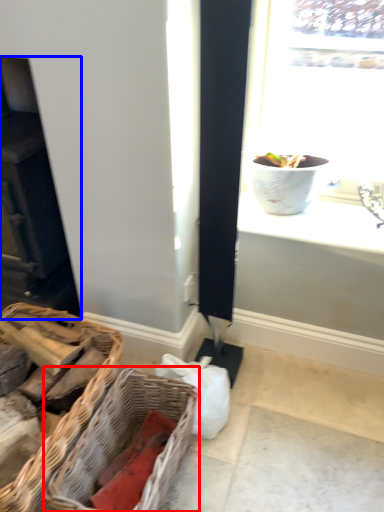
Question: Which of the following is the farthest to the observer, picnic basket (highlighted by a red box) or fireplace (highlighted by a blue box)?

Choices:
 (A) picnic basket
 (B) fireplace

Answer: (B)